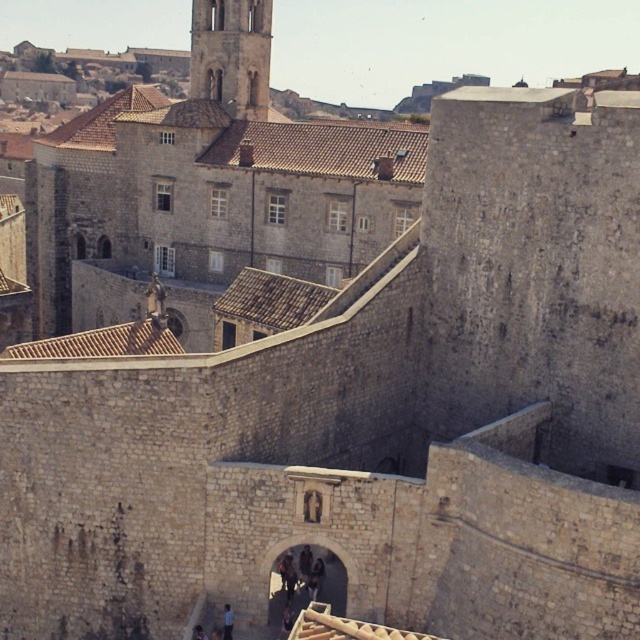
You are standing at the base of the historic stone wall and notice a point marked at coordinates (x=230, y=54). What structure is located at that specific point?

The light beige stone tower at upper center is located at point (x=230, y=54).

You are standing in front of the historic stone wall and want to take a photo of the light beige stone tower at upper center. If your camera has a maximum zoom range of 100 meters, will you be able to capture the tower clearly in your photo?

The distance between the light beige stone tower at upper center and the camera is 97.04 meters, which is within the camera maximum zoom range of 100 meters. Therefore, you can capture the tower clearly in your photo.

You are standing in front of the historic stone wall and want to determine the relative positions of two points marked on the wall. The first point is at coordinates point (212, 8) and the second is at point (230, 625). Which point is closer to you?

Point (212, 8) is closer to you because it is further to the viewer than point (230, 625).